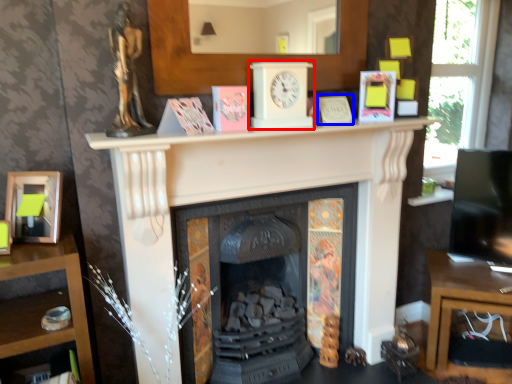
Question: Among these objects, which one is nearest to the camera, clock (highlighted by a red box) or paperback book (highlighted by a blue box)?

Choices:
 (A) clock
 (B) paperback book

Answer: (A)